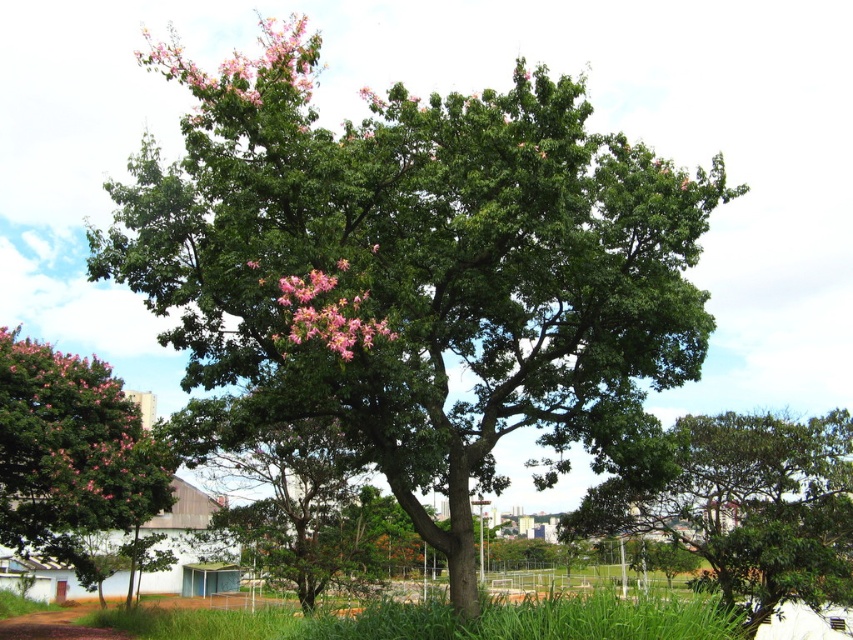
Between point (148, 444) and point (351, 625), which one is positioned behind?

The point (148, 444) is more distant.

Does pink glossy tree at left appear on the left side of green grass at lower center?

Correct, you'll find pink glossy tree at left to the left of green grass at lower center.

At what (x,y) coordinates should I click in order to perform the action: click on pink glossy tree at left. Please return your answer as a coordinate pair (x, y). Looking at the image, I should click on (71, 456).

Find the location of a particular element. This screenshot has width=853, height=640. pink glossy tree at left is located at coordinates coord(71,456).

Between green glossy tree at center and green grass at lower center, which one is positioned higher?

Positioned higher is green glossy tree at center.

Based on the photo, does green glossy tree at center have a larger size compared to green grass at lower center?

No, green glossy tree at center is not bigger than green grass at lower center.

Does point (746, 477) lie behind point (247, 634)?

No.

This screenshot has width=853, height=640. In order to click on green glossy tree at center in this screenshot , I will do click(x=734, y=500).

Between point (704, 596) and point (297, 310), which one is positioned behind?

The point (704, 596) is behind.

Does green grass at lower center have a larger size compared to pink matte flowers at center?

Yes, green grass at lower center is bigger than pink matte flowers at center.

Where is `green grass at lower center`? green grass at lower center is located at coordinates (445, 620).